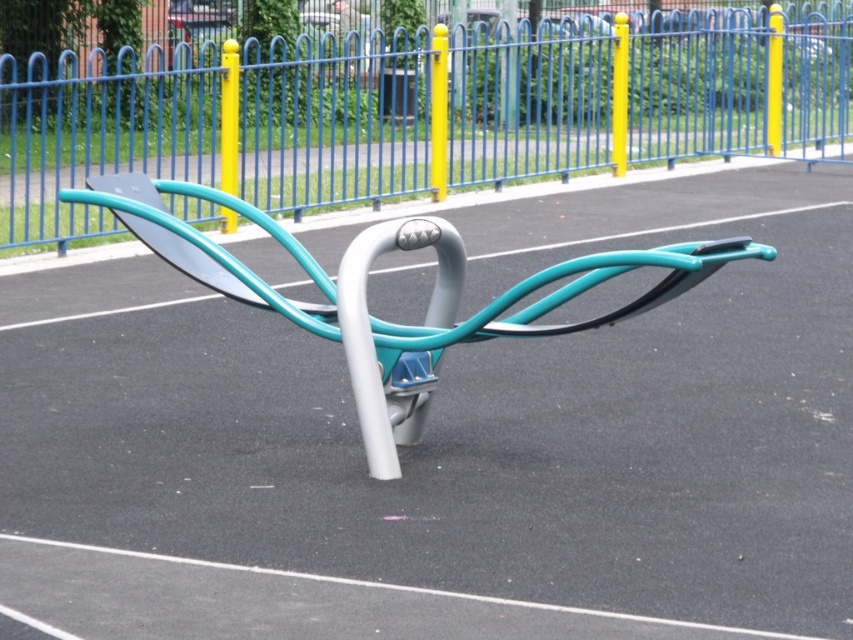
You are a park visitor trying to locate the entrance gate. You see the yellow glossy pole at upper center and the matte yellow pole at upper right. Which pole is closer to you?

The yellow glossy pole at upper center is closer to you because it is in front of the matte yellow pole at upper right.

You are a park visitor standing at the entrance and looking towards the fitness area. Which object, the blue metal fence at upper center or the yellow matte pole at upper right, is positioned higher from the ground?

The blue metal fence at upper center is below the yellow matte pole at upper right, so the yellow matte pole at upper right is higher from the ground.

You are standing at the point marked by point (97, 132). What object are you facing?

The point (97, 132) marks the blue metal fence at upper center, so you are facing the blue metal fence at upper center.